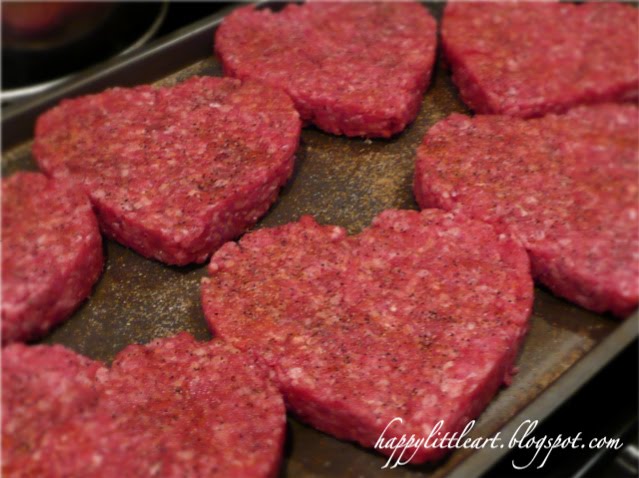
Where is `tray`? The image size is (639, 478). tray is located at coordinates (326, 459), (151, 298), (17, 147), (192, 69), (335, 180), (578, 334), (436, 7), (635, 100), (576, 2).